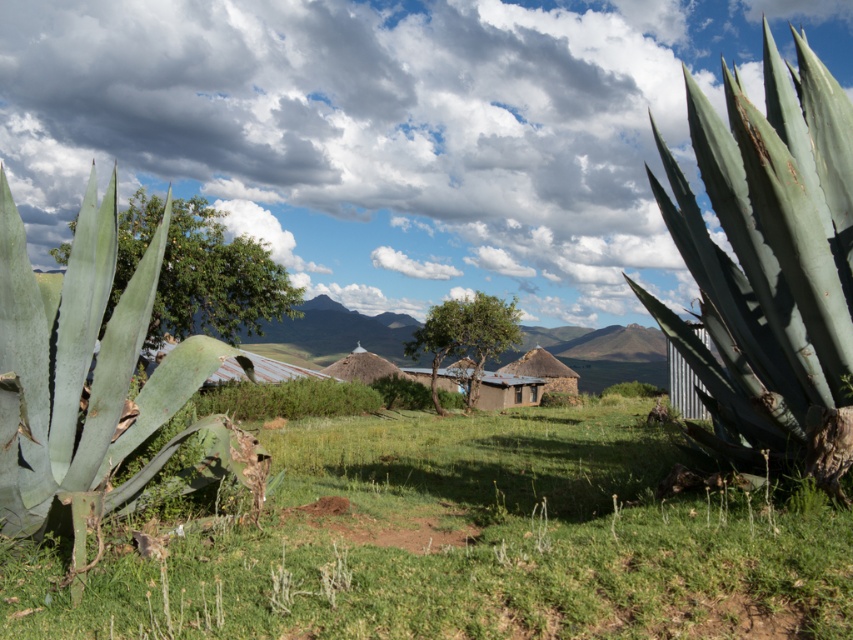
In the scene shown: You are a botanist studying plant growth in this rural area. You observe the green succulent at center and the green leafy tree at center. Which of these two plants is shorter?

The green succulent at center is not as tall as the green leafy tree at center, so the green succulent at center is shorter.